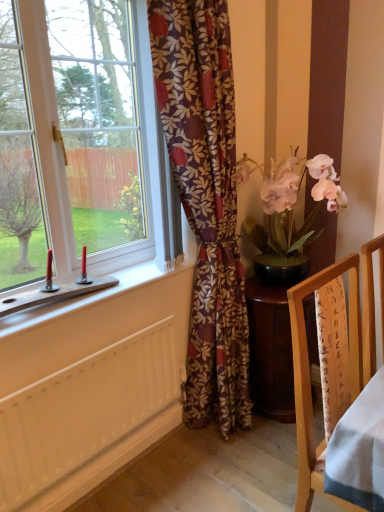
Find the location of a particular element. Image resolution: width=384 pixels, height=512 pixels. vacant space in front of floral-patterned fabric at center is located at coordinates (219, 469).